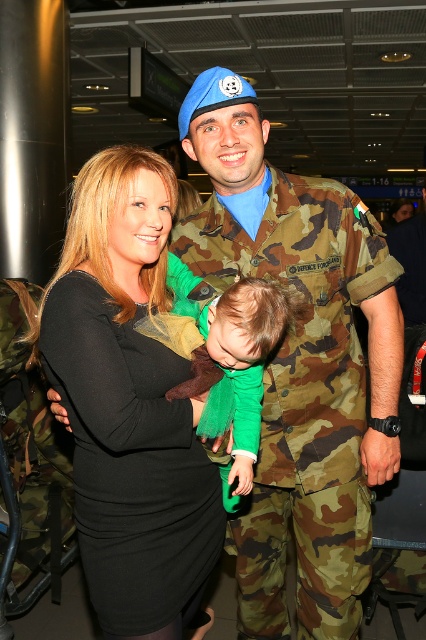
Question: Among these points, which one is nearest to the camera?

Choices:
 (A) (259, 612)
 (B) (143, 346)

Answer: (B)

Question: Which point appears closest to the camera in this image?

Choices:
 (A) (342, 600)
 (B) (49, 282)

Answer: (B)

Question: Can you confirm if camouflage uniform at center is positioned below black matte dress at center?

Choices:
 (A) no
 (B) yes

Answer: (A)

Question: Among these points, which one is nearest to the camera?

Choices:
 (A) (146, 422)
 (B) (339, 243)

Answer: (A)

Question: Does camouflage uniform at center appear on the right side of black matte dress at center?

Choices:
 (A) yes
 (B) no

Answer: (A)

Question: Does camouflage uniform at center appear on the left side of black matte dress at center?

Choices:
 (A) no
 (B) yes

Answer: (A)